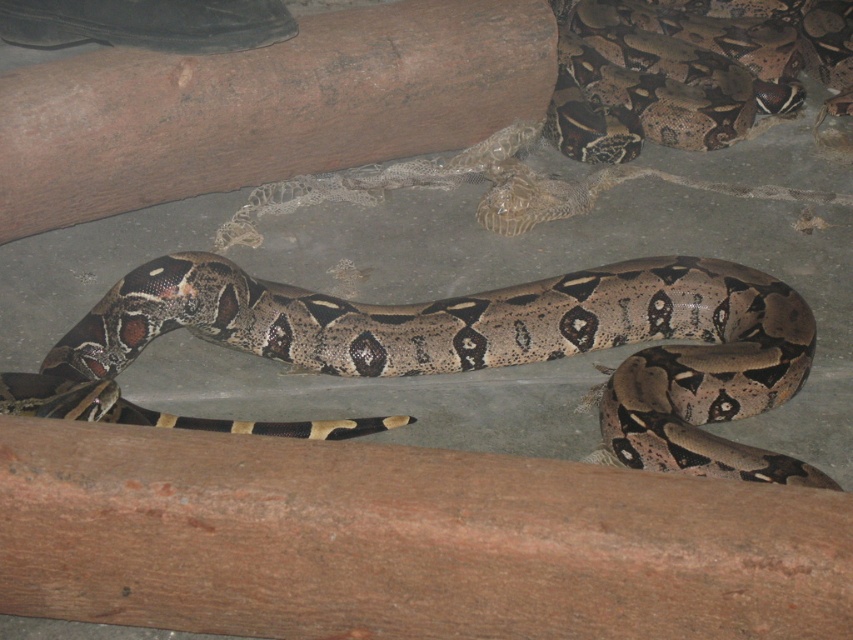
You are a zookeeper observing the boa constrictors in their enclosure. You see the brown rough log at center and the brown textured snake at center. Which object is closer to you?

The brown rough log at center is closer to the viewer than the brown textured snake at center.